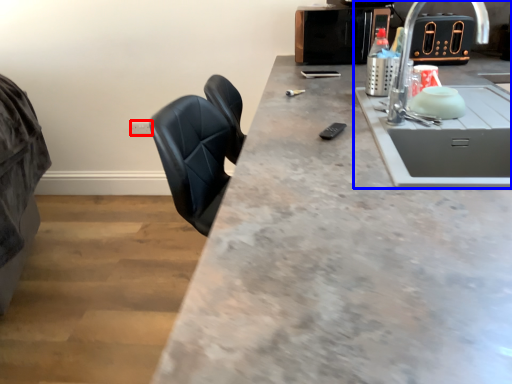
Question: Which object is further to the camera taking this photo, electric outlet (highlighted by a red box) or sink (highlighted by a blue box)?

Choices:
 (A) electric outlet
 (B) sink

Answer: (A)